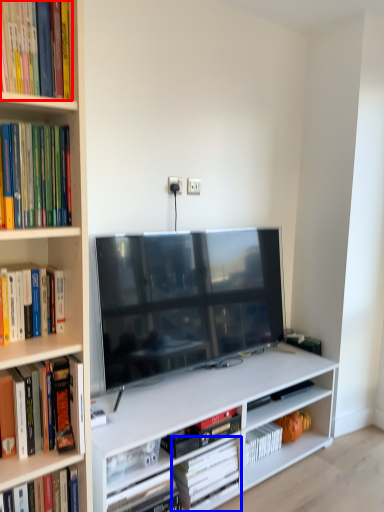
Question: Which point is further to the camera, book (highlighted by a red box) or book (highlighted by a blue box)?

Choices:
 (A) book
 (B) book

Answer: (B)